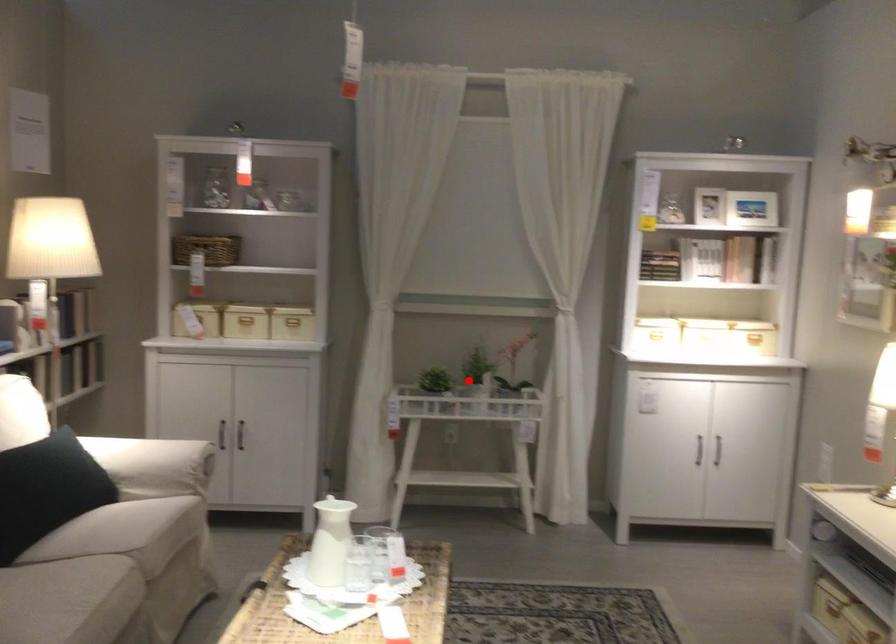
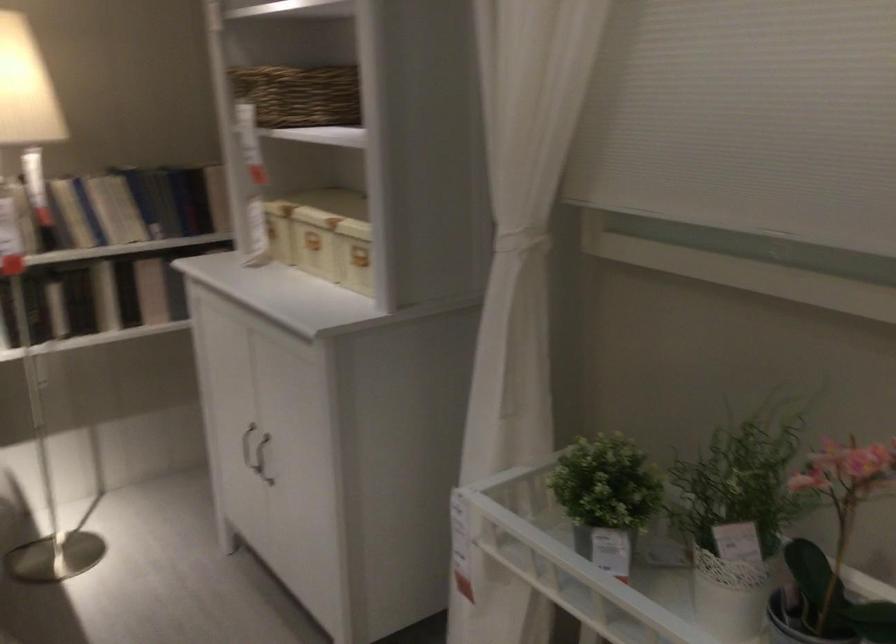
Question: I am providing you with two images of the same scene from different viewpoints. Image1 has a red point marked. In image2, the corresponding 3D location appears at what relative position? Reply with the corresponding letter.

Choices:
 (A) Closer
 (B) Farther

Answer: (A)